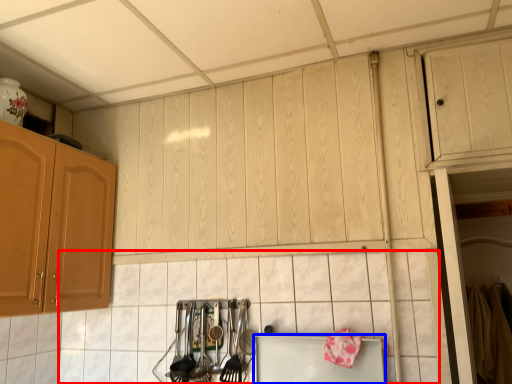
Question: Among these objects, which one is farthest to the camera, tile (highlighted by a red box) or appliance (highlighted by a blue box)?

Choices:
 (A) tile
 (B) appliance

Answer: (B)